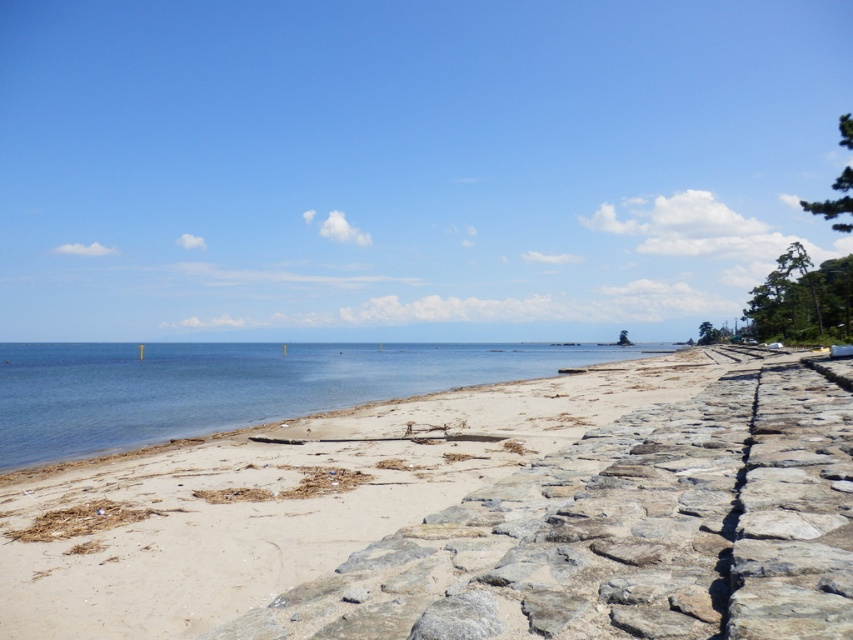
Which of these two, light brown sand at lower left or blue water at center, stands taller?

Standing taller between the two is blue water at center.

Does light brown sand at lower left appear under blue water at center?

No.

Does point (10, 580) come closer to viewer compared to point (425, 349)?

Yes.

Where is `light brown sand at lower left`? light brown sand at lower left is located at coordinates (289, 499).